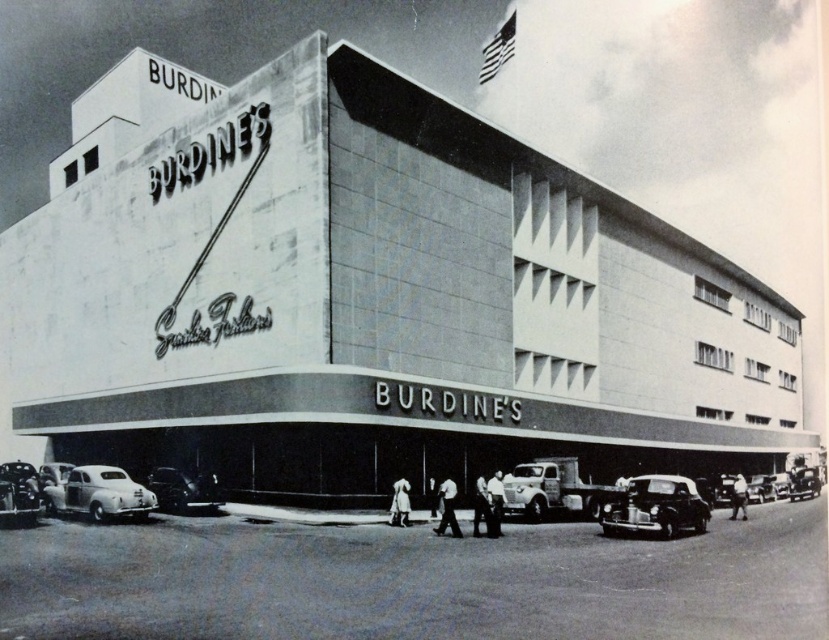
You are a delivery driver who needs to enter a parking garage with a height restriction of 6 feet. You have a metallic silver truck at center and a shiny silver car at lower left. Which vehicle can safely pass under the height restriction?

The metallic silver truck at center is much taller than the shiny silver car at lower left, so the shiny silver car at lower left can safely pass under the 6 feet height restriction while the metallic silver truck at center cannot.

You are a pedestrian standing in front of Burdine department store and want to cross the street. You see a metallic silver truck at center and a shiny black car at lower left. Which vehicle is closer to you?

The metallic silver truck at center is closer to the viewer than the shiny black car at lower left.